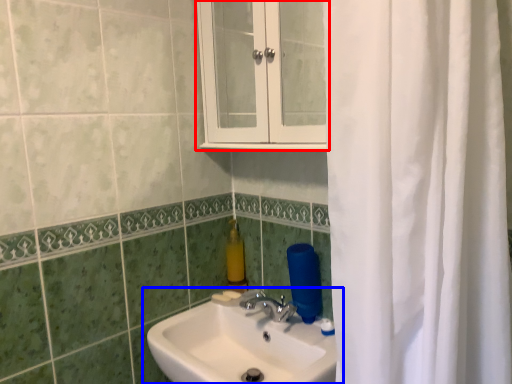
Question: Which of the following is the farthest to the observer, medicine cabinet (highlighted by a red box) or sink (highlighted by a blue box)?

Choices:
 (A) medicine cabinet
 (B) sink

Answer: (A)